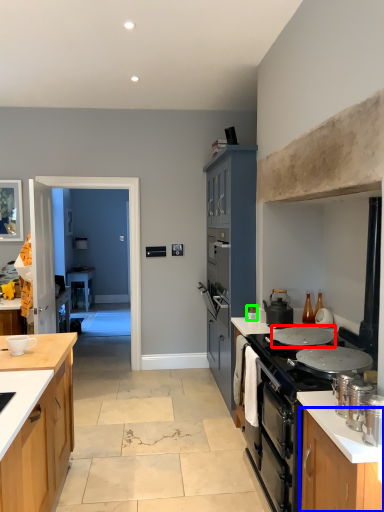
Question: Estimate the real-world distances between objects in this image. Which object is closer to pot/pan (highlighted by a red box), cabinetry (highlighted by a blue box) or kitchen appliance (highlighted by a green box)?

Choices:
 (A) cabinetry
 (B) kitchen appliance

Answer: (B)